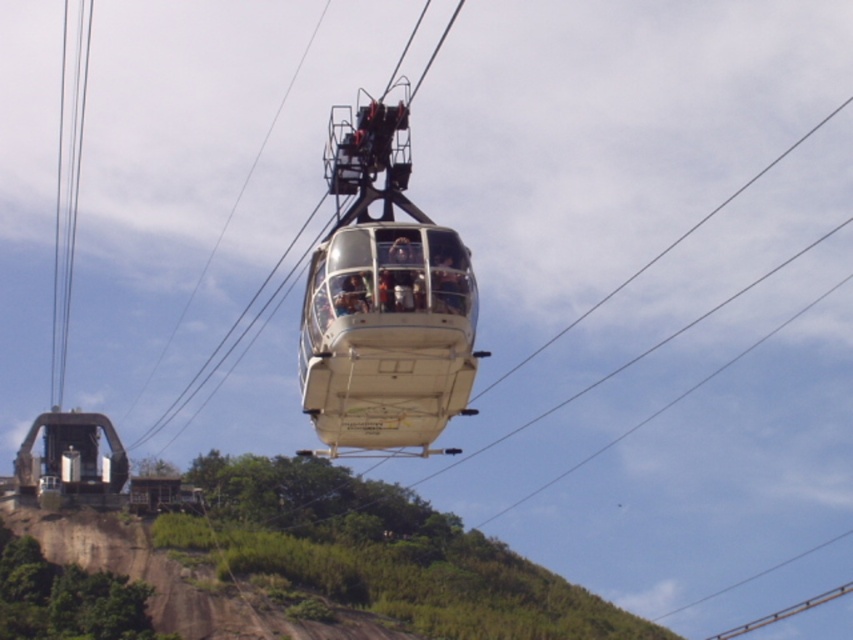
Can you confirm if white glossy cable car at center is bigger than clear glass cables at upper left?

Correct, white glossy cable car at center is larger in size than clear glass cables at upper left.

Can you confirm if white glossy cable car at center is positioned to the left of clear glass cables at upper left?

Incorrect, white glossy cable car at center is not on the left side of clear glass cables at upper left.

Locate an element on the screen. The image size is (853, 640). white glossy cable car at center is located at coordinates (387, 337).

I want to click on white glossy cable car at center, so pos(387,337).